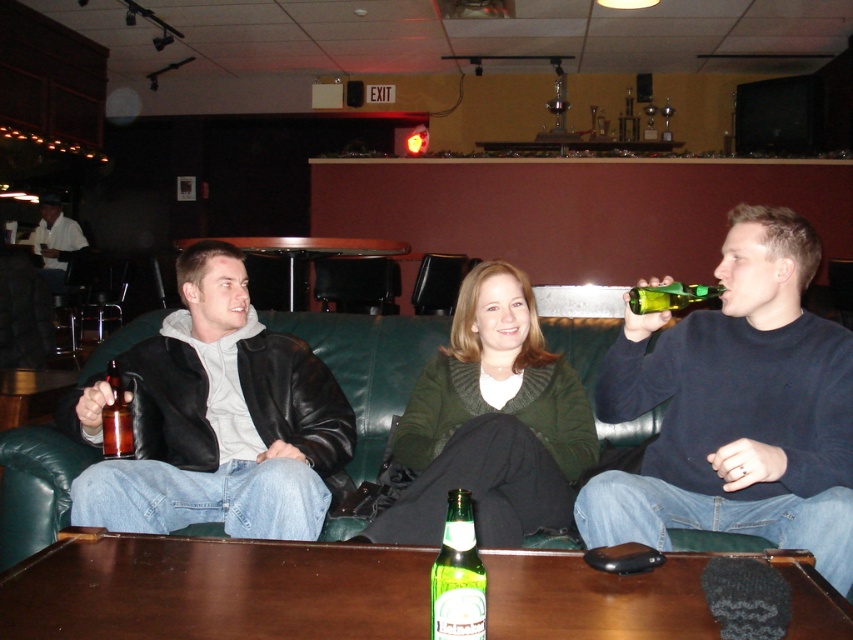
Which is in front, point (610, 432) or point (289, 275)?

Point (610, 432)

Does green leather couch at center have a greater width compared to wooden round table at center?

No, green leather couch at center is not wider than wooden round table at center.

What do you see at coordinates (367, 365) in the screenshot? I see `green leather couch at center` at bounding box center [367, 365].

Identify the location of green leather couch at center. (367, 365).

Is dark blue sweater at right further to the viewer compared to green glass bottle at center?

Yes, dark blue sweater at right is behind green glass bottle at center.

Does dark blue sweater at right appear on the right side of green glass bottle at center?

Indeed, dark blue sweater at right is positioned on the right side of green glass bottle at center.

This screenshot has height=640, width=853. Find the location of `dark blue sweater at right`. dark blue sweater at right is located at coordinates (735, 410).

Where is `dark blue sweater at right`? This screenshot has height=640, width=853. dark blue sweater at right is located at coordinates (735, 410).

Is white shirt at left bigger than green glass bottle at upper right?

Correct, white shirt at left is larger in size than green glass bottle at upper right.

Which of these two, white shirt at left or green glass bottle at upper right, stands taller?

white shirt at left is taller.

Who is more forward, (53, 237) or (666, 289)?

Point (666, 289) is in front.

Find the location of a particular element. white shirt at left is located at coordinates (55, 241).